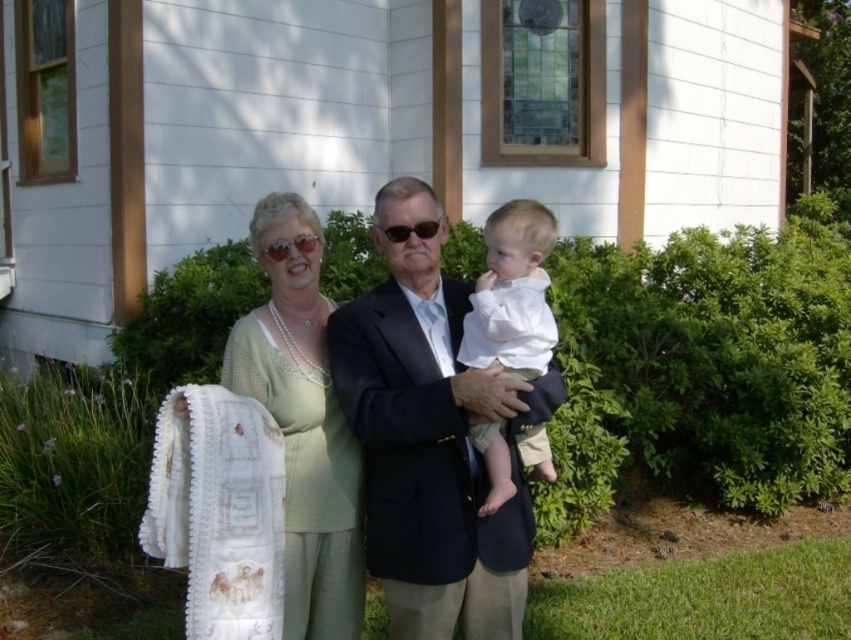
Question: Which of the following is the closest to the observer?

Choices:
 (A) pyautogui.click(x=494, y=289)
 (B) pyautogui.click(x=312, y=586)
 (C) pyautogui.click(x=421, y=468)

Answer: (C)

Question: Does linen dress at center have a lesser width compared to white cotton shirt at center?

Choices:
 (A) yes
 (B) no

Answer: (B)

Question: Can you confirm if linen dress at center is positioned below white cotton shirt at center?

Choices:
 (A) no
 (B) yes

Answer: (B)

Question: Which object appears closest to the camera in this image?

Choices:
 (A) linen dress at center
 (B) dark blue suit at center
 (C) white cotton shirt at center

Answer: (A)

Question: Considering the real-world distances, which object is closest to the linen dress at center?

Choices:
 (A) white cotton shirt at center
 (B) dark blue suit at center

Answer: (B)

Question: Does linen dress at center have a lesser width compared to white cotton shirt at center?

Choices:
 (A) yes
 (B) no

Answer: (B)